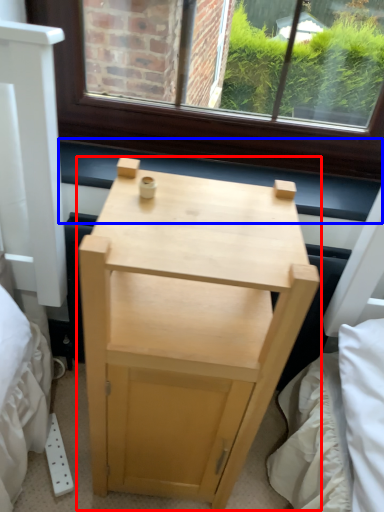
Question: Which object appears farthest to the camera in this image, nightstand (highlighted by a red box) or window sill (highlighted by a blue box)?

Choices:
 (A) nightstand
 (B) window sill

Answer: (B)